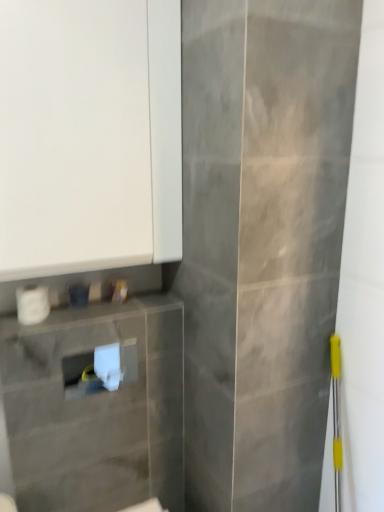
Find the location of a particular element. The height and width of the screenshot is (512, 384). vacant space underneath white matte cabinet at upper left (from a real-world perspective) is located at coordinates (100, 311).